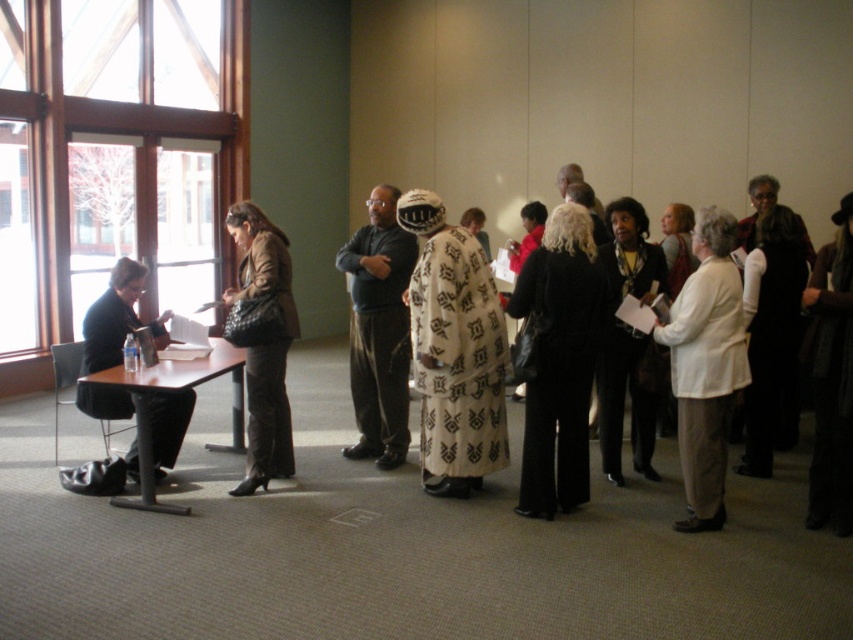
Between clear glass window at left and brown wood table at left, which one appears on the left side from the viewer's perspective?

clear glass window at left

Based on the photo, can you confirm if clear glass window at left is positioned above brown wood table at left?

Indeed, clear glass window at left is positioned over brown wood table at left.

The image size is (853, 640). I want to click on clear glass window at left, so click(x=115, y=154).

Between matte black jacket at left and brown wood table at left, which one is positioned higher?

matte black jacket at left is higher up.

From the picture: Is matte black jacket at left above brown wood table at left?

Yes, matte black jacket at left is above brown wood table at left.

You are a GUI agent. You are given a task and a screenshot of the screen. Output one action in this format:
    pyautogui.click(x=<x>, y=<y>)
    Task: Click on the matte black jacket at left
    
    Given the screenshot: What is the action you would take?
    pyautogui.click(x=117, y=317)

Where is `matte black jacket at left`? The height and width of the screenshot is (640, 853). matte black jacket at left is located at coordinates (117, 317).

Who is more distant from viewer, (471,355) or (285,305)?

Positioned behind is point (285,305).

Is white textured coat at center shorter than matte brown coat at center?

No.

Describe the element at coordinates (454, 349) in the screenshot. I see `white textured coat at center` at that location.

Locate an element on the screen. The width and height of the screenshot is (853, 640). white textured coat at center is located at coordinates (454, 349).